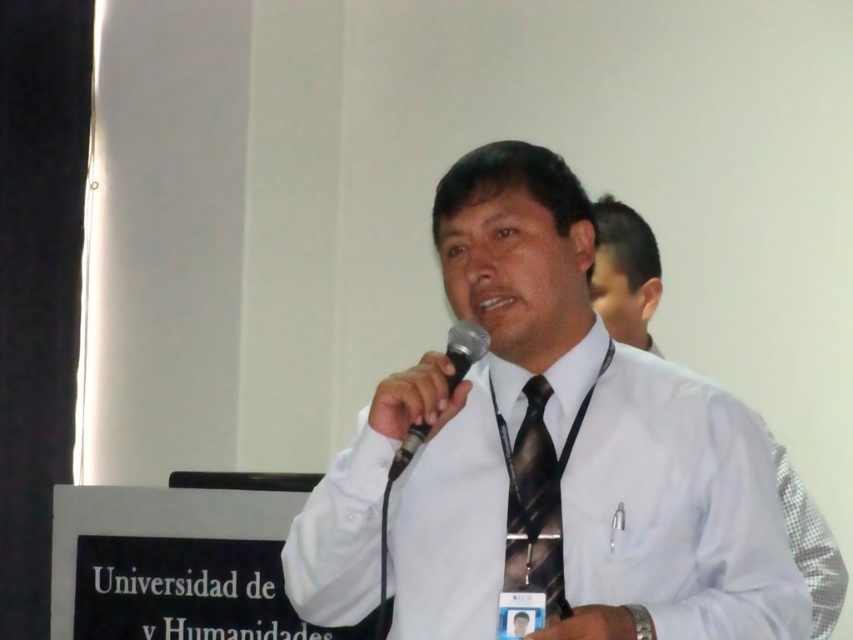
Is point (723, 618) positioned before point (790, 515)?

Yes.

Based on the photo, is white glossy shirt at center smaller than white shirt at center?

Actually, white glossy shirt at center might be larger than white shirt at center.

In order to click on white glossy shirt at center in this screenshot , I will do `click(548, 456)`.

Is white shirt at center below black plastic microphone at center?

Actually, white shirt at center is above black plastic microphone at center.

Is white shirt at center above black plastic microphone at center?

Yes, white shirt at center is above black plastic microphone at center.

Identify the location of white shirt at center. This screenshot has height=640, width=853. (625, 273).

Measure the distance from white glossy shirt at center to black striped tie at center.

white glossy shirt at center and black striped tie at center are 5.22 inches apart.

Who is higher up, white glossy shirt at center or black striped tie at center?

white glossy shirt at center is above.

What do you see at coordinates (548, 456) in the screenshot?
I see `white glossy shirt at center` at bounding box center [548, 456].

At what (x,y) coordinates should I click in order to perform the action: click on white glossy shirt at center. Please return your answer as a coordinate pair (x, y). This screenshot has width=853, height=640. Looking at the image, I should click on (548, 456).